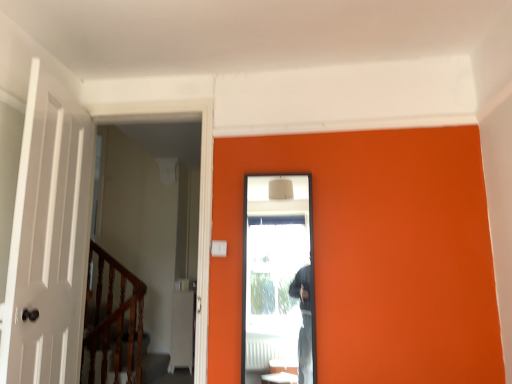
Question: Looking at the image, does clear glass screen door at center seem bigger or smaller compared to wooden polished rail at left?

Choices:
 (A) big
 (B) small

Answer: (B)

Question: From the image's perspective, is clear glass screen door at center positioned above or below wooden polished rail at left?

Choices:
 (A) above
 (B) below

Answer: (A)

Question: In terms of height, does clear glass screen door at center look taller or shorter compared to wooden polished rail at left?

Choices:
 (A) short
 (B) tall

Answer: (A)

Question: Does point (139, 380) appear closer or farther from the camera than point (282, 289)?

Choices:
 (A) farther
 (B) closer

Answer: (A)

Question: Considering the positions of wooden polished rail at left and clear glass screen door at center in the image, is wooden polished rail at left wider or thinner than clear glass screen door at center?

Choices:
 (A) wide
 (B) thin

Answer: (A)

Question: From a real-world perspective, is wooden polished rail at left above or below clear glass screen door at center?

Choices:
 (A) above
 (B) below

Answer: (B)

Question: Is wooden polished rail at left in front of or behind clear glass screen door at center in the image?

Choices:
 (A) front
 (B) behind

Answer: (B)